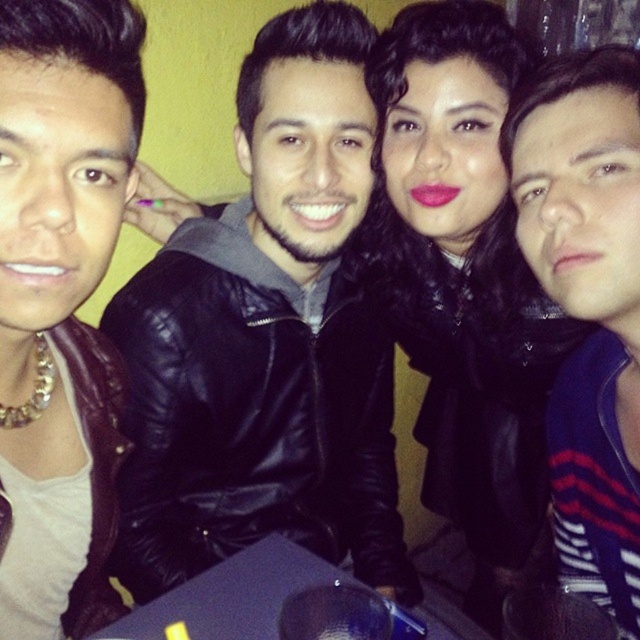
Is point (211, 337) behind point (461, 451)?

No, (211, 337) is in front of (461, 451).

Is point (358, 362) positioned in front of point (541, 301)?

No, (358, 362) is behind (541, 301).

Find the location of a particular element. This screenshot has height=640, width=640. black leather jacket at center is located at coordinates (266, 339).

Who is lower down, black leather jacket at center or dark blue sweater at right?

dark blue sweater at right is lower down.

Between point (310, 108) and point (624, 540), which one is positioned behind?

Point (310, 108)

Where is `black leather jacket at center`? The height and width of the screenshot is (640, 640). black leather jacket at center is located at coordinates (266, 339).

Does black leather jacket at upper center have a lesser height compared to dark blue sweater at right?

In fact, black leather jacket at upper center may be taller than dark blue sweater at right.

Can you confirm if black leather jacket at upper center is positioned to the left of dark blue sweater at right?

Indeed, black leather jacket at upper center is positioned on the left side of dark blue sweater at right.

Does point (484, 148) lie behind point (608, 64)?

Yes.

The width and height of the screenshot is (640, 640). What are the coordinates of `black leather jacket at upper center` in the screenshot? It's located at (464, 284).